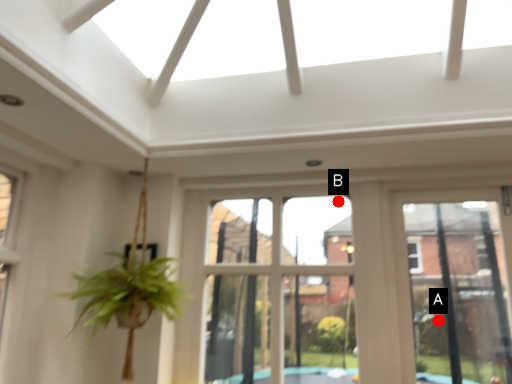
Question: Two points are circled on the image, labeled by A and B beside each circle. Which of the following is the farthest from the observer?

Choices:
 (A) A is further
 (B) B is further

Answer: (B)